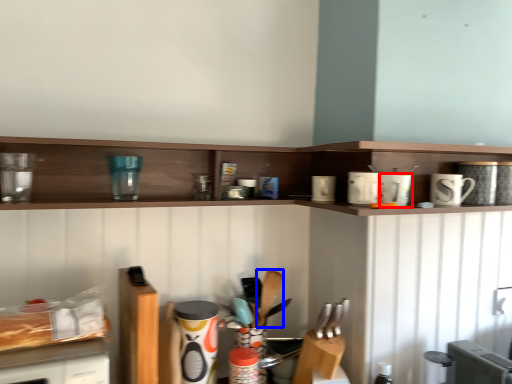
Question: Which object is further to the camera taking this photo, appliance (highlighted by a red box) or silverware (highlighted by a blue box)?

Choices:
 (A) appliance
 (B) silverware

Answer: (B)